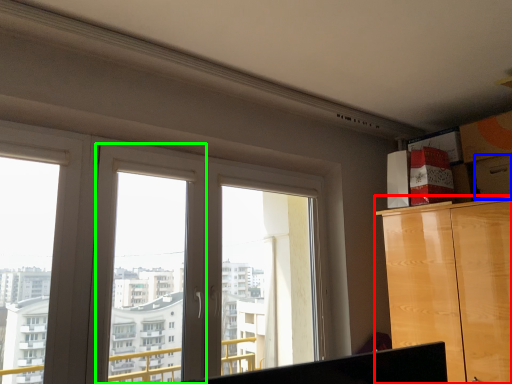
Question: Based on their relative distances, which object is nearer to cabinetry (highlighted by a red box)? Choose from drawer (highlighted by a blue box) and window frame (highlighted by a green box).

Choices:
 (A) drawer
 (B) window frame

Answer: (A)